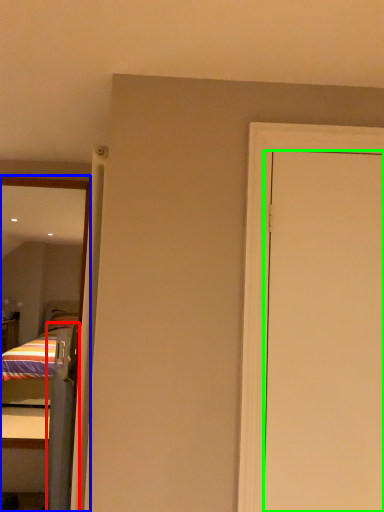
Question: Which is nearer to the screen door (highlighted by a red box)? mirror (highlighted by a blue box) or door (highlighted by a green box).

Choices:
 (A) mirror
 (B) door

Answer: (A)